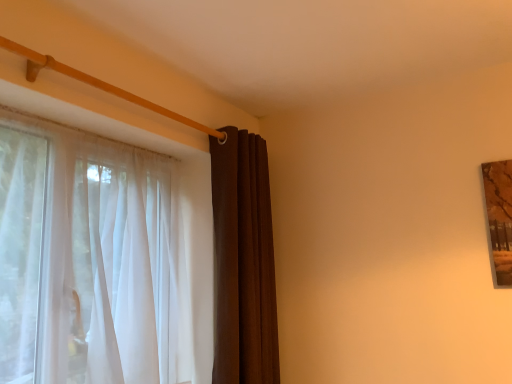
Question: Would you say brown velvet curtain at center, the first curtain when ordered from right to left, is inside or outside sheer white curtain at left, which is the first curtain in left-to-right order?

Choices:
 (A) outside
 (B) inside

Answer: (A)

Question: From the image's perspective, is brown velvet curtain at center, acting as the second curtain starting from the left, positioned above or below sheer white curtain at left, which is the first curtain in left-to-right order?

Choices:
 (A) above
 (B) below

Answer: (B)

Question: Considering the positions of point (245, 334) and point (148, 183), is point (245, 334) closer or farther from the camera than point (148, 183)?

Choices:
 (A) closer
 (B) farther

Answer: (A)

Question: Considering the positions of point (84, 266) and point (250, 278), is point (84, 266) closer or farther from the camera than point (250, 278)?

Choices:
 (A) farther
 (B) closer

Answer: (B)

Question: Is sheer white curtain at left, which is the first curtain in left-to-right order, bigger or smaller than brown velvet curtain at center, acting as the second curtain starting from the left?

Choices:
 (A) small
 (B) big

Answer: (B)

Question: Do you think sheer white curtain at left, which is the first curtain in left-to-right order, is within brown velvet curtain at center, acting as the second curtain starting from the left, or outside of it?

Choices:
 (A) outside
 (B) inside

Answer: (A)

Question: Considering the relative positions of sheer white curtain at left, which ranks as the second curtain in right-to-left order, and brown velvet curtain at center, the first curtain when ordered from right to left, in the image provided, is sheer white curtain at left, which ranks as the second curtain in right-to-left order, to the left or to the right of brown velvet curtain at center, the first curtain when ordered from right to left,?

Choices:
 (A) left
 (B) right

Answer: (A)